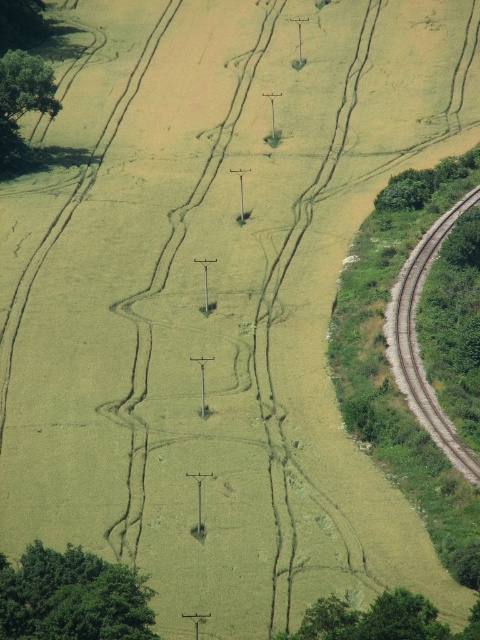
Does green leafy tree at lower left appear under green leafy tree at upper left?

Yes.

Between point (107, 563) and point (3, 145), which one is positioned in front?

Point (107, 563)

Between point (143, 588) and point (50, 68), which one is positioned in front?

Point (143, 588) is in front.

This screenshot has width=480, height=640. I want to click on green leafy tree at lower left, so click(72, 596).

How much distance is there between brown gravel train track at right and green leafy tree at upper left?

brown gravel train track at right and green leafy tree at upper left are 33.38 meters apart from each other.

Is brown gravel train track at right behind green leafy tree at upper left?

That is False.

Identify the location of brown gravel train track at right. (418, 342).

Does green leafy tree at upper left come in front of green leafy tree at right?

No, green leafy tree at upper left is further to the viewer.

Which is behind, point (13, 141) or point (455, 196)?

Point (13, 141)

I want to click on green leafy tree at upper left, so click(22, 104).

Find the location of a particular element. This screenshot has height=640, width=480. green leafy tree at upper left is located at coordinates (22, 104).